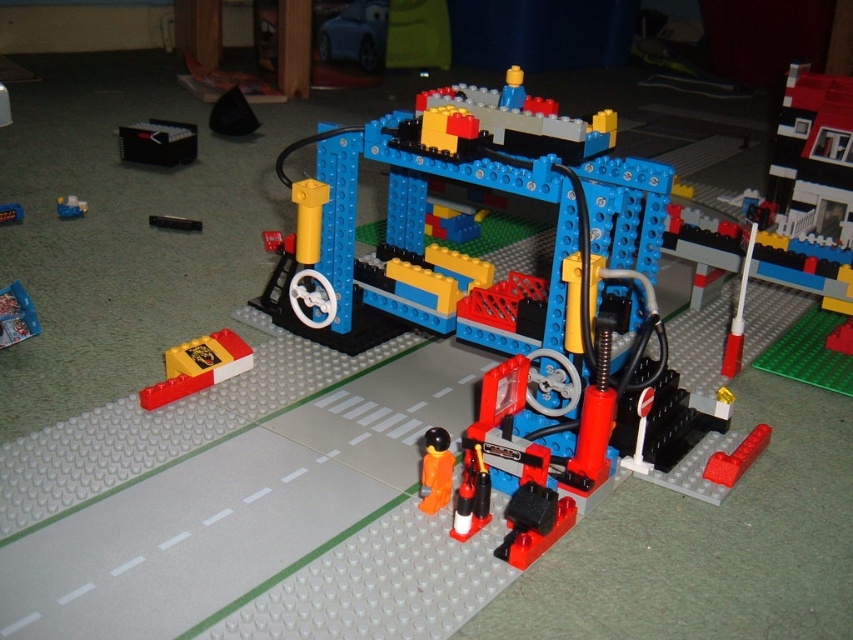
What do you see at coordinates (434, 470) in the screenshot?
I see `orange matte figure at center` at bounding box center [434, 470].

Can you confirm if orange matte figure at center is positioned to the right of matte yellow brick at center?

Yes, orange matte figure at center is to the right of matte yellow brick at center.

Find the location of a particular element. orange matte figure at center is located at coordinates (434, 470).

Which is in front, point (134, 138) or point (4, 209)?

Positioned in front is point (4, 209).

Locate an element on the screen. The image size is (853, 640). black plastic remote control at upper left is located at coordinates (158, 141).

Does point (438, 458) come behind point (15, 209)?

No, it is not.

The image size is (853, 640). In order to click on orange matte figure at center in this screenshot , I will do `click(434, 470)`.

The height and width of the screenshot is (640, 853). Identify the location of orange matte figure at center. (434, 470).